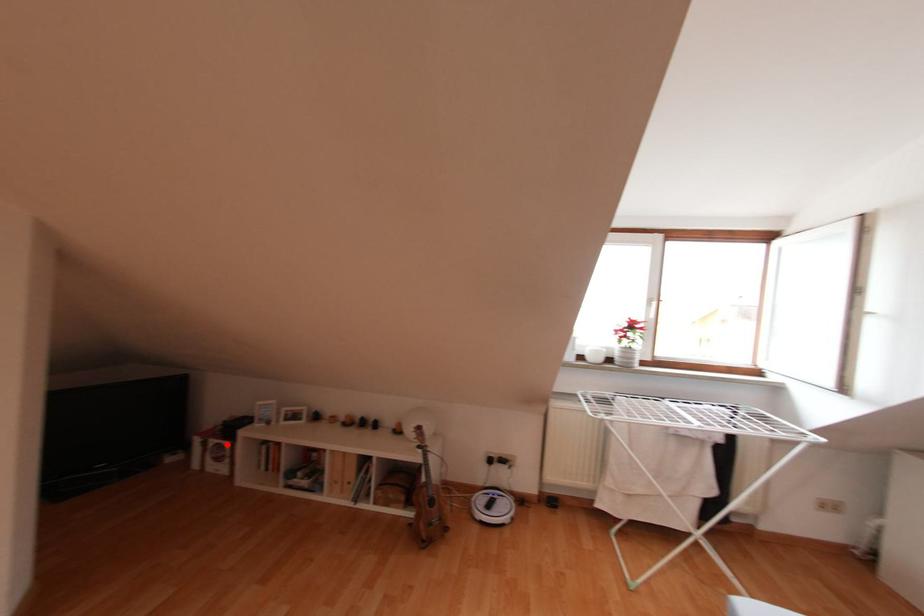
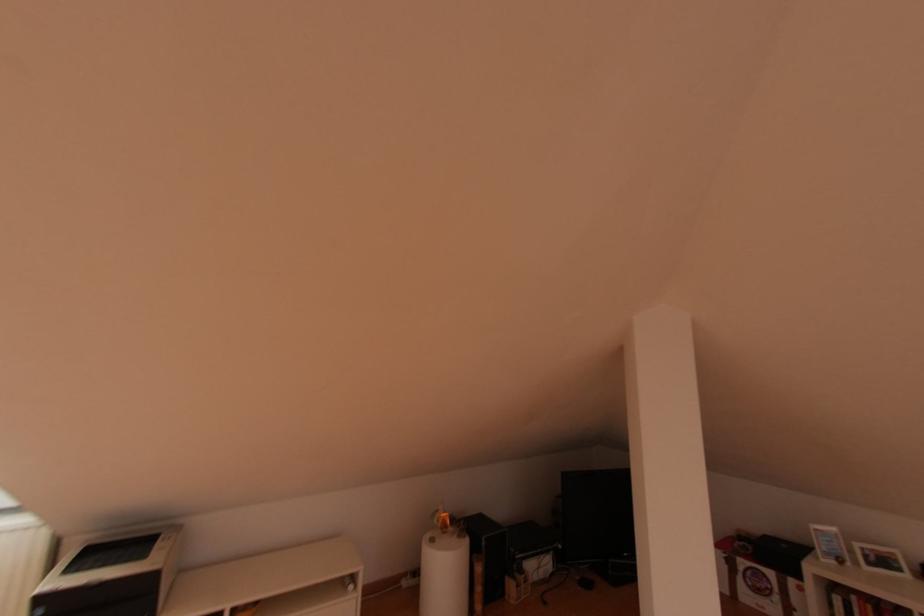
Question: A red point is marked in image1. In image2, is the corresponding 3D point closer to the camera or farther? Reply with the corresponding letter.

Choices:
 (A) The corresponding 3D point is closer.
 (B) The corresponding 3D point is farther.

Answer: (A)